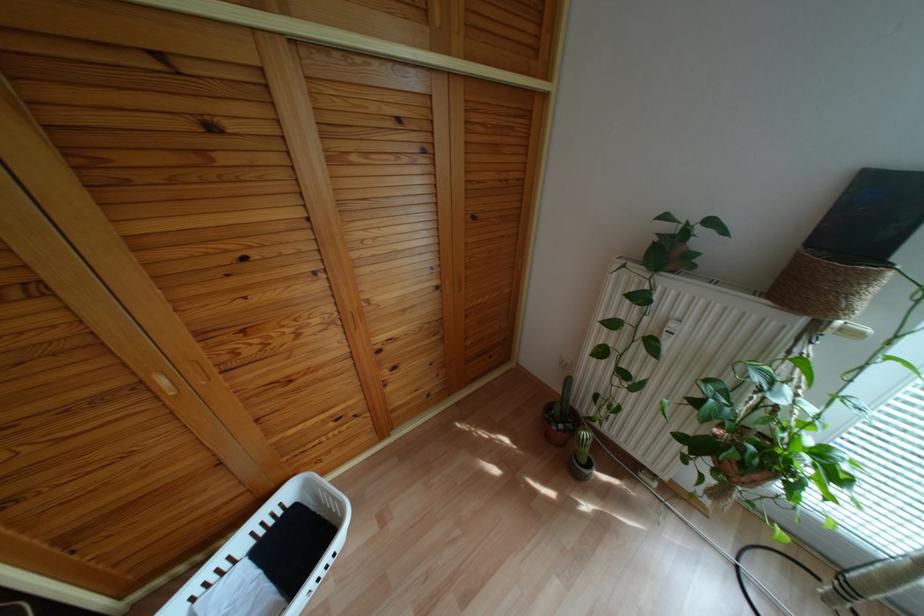
Find the location of `terracotta plant pot`. terracotta plant pot is located at coordinates (742, 464).